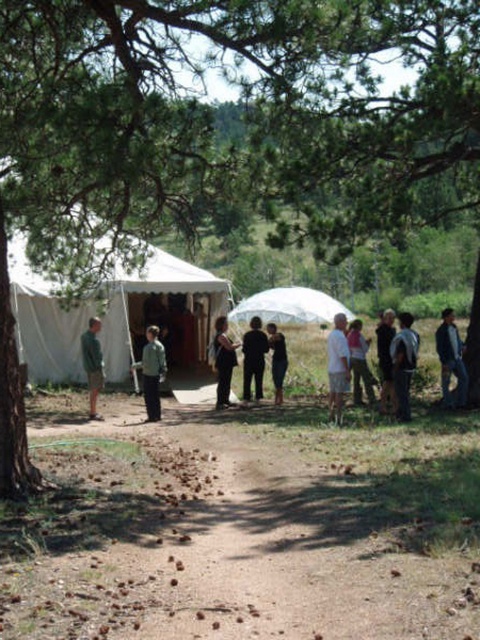
Which is above, dirt path at center or white canvas tent at center?

white canvas tent at center is higher up.

Based on the photo, between dirt path at center and white canvas tent at center, which one appears on the right side from the viewer's perspective?

dirt path at center is more to the right.

Who is more forward, (x=251, y=573) or (x=31, y=269)?

Point (x=251, y=573) is in front.

The image size is (480, 640). What are the coordinates of `dirt path at center` in the screenshot? It's located at (242, 525).

Who is lower down, brown leather jacket at right or black cotton pants at center?

brown leather jacket at right

Between brown leather jacket at right and black cotton pants at center, which one is positioned higher?

Positioned higher is black cotton pants at center.

Which is in front, point (455, 332) or point (257, 317)?

Point (455, 332)

The height and width of the screenshot is (640, 480). Find the location of `brown leather jacket at right`. brown leather jacket at right is located at coordinates (451, 358).

How far apart are dark gray fabric jacket at center and pink fabric umbrella at center?

dark gray fabric jacket at center is 4.24 meters from pink fabric umbrella at center.

Does dark gray fabric jacket at center lie behind pink fabric umbrella at center?

No.

This screenshot has height=640, width=480. What do you see at coordinates (152, 371) in the screenshot?
I see `dark gray fabric jacket at center` at bounding box center [152, 371].

What are the coordinates of `dark gray fabric jacket at center` in the screenshot? It's located at (152, 371).